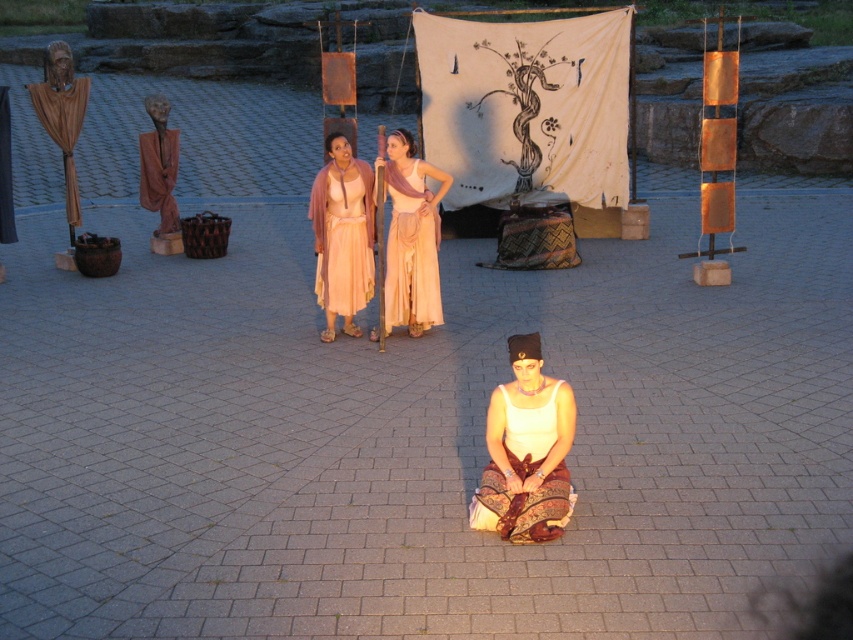
Question: Can you confirm if matte brown robe at left is positioned to the right of brown matte robe at left?

Choices:
 (A) no
 (B) yes

Answer: (A)

Question: Is matte pink fabric at center positioned at the back of white cotton dress at center?

Choices:
 (A) yes
 (B) no

Answer: (A)

Question: Estimate the real-world distances between objects in this image. Which object is closer to the matte pink fabric at center?

Choices:
 (A) matte peach fabric dress at center
 (B) brown matte robe at left

Answer: (A)

Question: Does matte peach fabric dress at center appear on the right side of matte brown robe at left?

Choices:
 (A) no
 (B) yes

Answer: (B)

Question: Considering the real-world distances, which object is farthest from the matte peach fabric dress at center?

Choices:
 (A) white cotton dress at center
 (B) matte brown robe at left

Answer: (B)

Question: Which point appears closest to the camera in this image?

Choices:
 (A) (497, 522)
 (B) (347, 257)
 (C) (392, 188)
 (D) (175, 136)

Answer: (A)